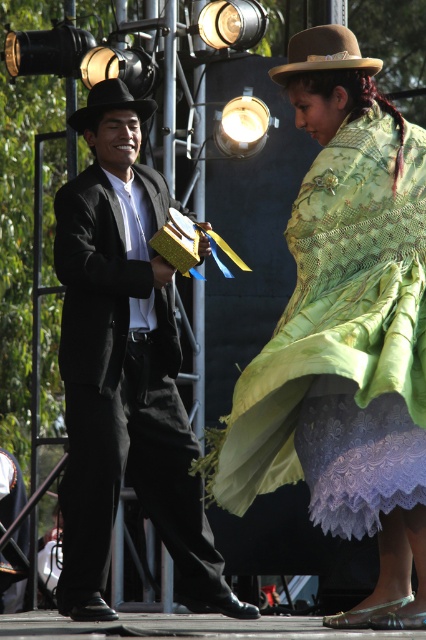
You are standing in front of the stage and want to locate the brown felt hat at upper center. According to the coordinates provided, which direction should you look to find it?

The brown felt hat at upper center is located at coordinates point (324, 52), so you should look to the upper center direction to find it.

You are a photographer on the stage and need to adjust the lighting so that the green embroidered shawl at center and the black felt cowboy hat at left are both well lit. Which object should you move closer to the front to ensure proper illumination?

The green embroidered shawl at center is already in front of the black felt cowboy hat at left, so to ensure proper illumination, you should keep the green embroidered shawl at center where it is and adjust the lighting towards it since it is closer to the front.

You are a photographer positioned at the front of the stage. You need to adjust your camera focus to capture both the matte black suit at center and the brown felt hat at upper center clearly. Given that your camera has a depth of field range of 10 meters, will both subjects be in focus?

The matte black suit at center is 10.52 meters away from the brown felt hat at upper center. Since the distance between them exceeds the camera depth of field range of 10 meters, adjusting the focus might require prioritizing one subject over the other to ensure clarity.